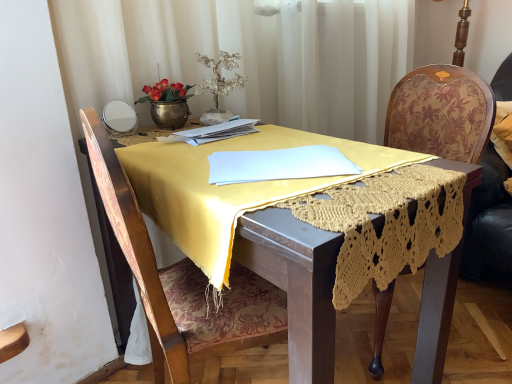
I want to click on empty space that is to the right of white paper at center, so click(x=276, y=136).